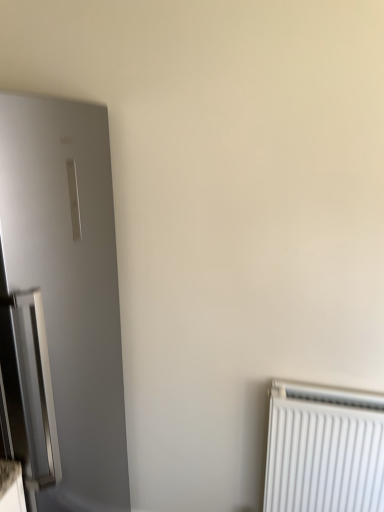
Measure the distance between white plastic radiator at lower right and camera.

white plastic radiator at lower right and camera are 1.37 meters apart.

At what (x,y) coordinates should I click in order to perform the action: click on white plastic radiator at lower right. Please return your answer as a coordinate pair (x, y). The image size is (384, 512). Looking at the image, I should click on (324, 449).

The height and width of the screenshot is (512, 384). What do you see at coordinates (324, 449) in the screenshot?
I see `white plastic radiator at lower right` at bounding box center [324, 449].

Find the location of `white plastic radiator at lower right`. white plastic radiator at lower right is located at coordinates (324, 449).